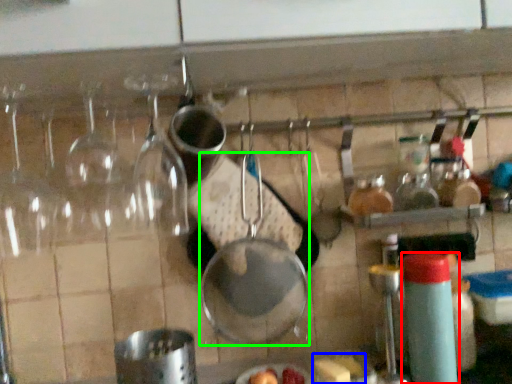
Question: Estimate the real-world distances between objects in this image. Which object is farther from bottle (highlighted by a red box), food (highlighted by a blue box) or frying pan (highlighted by a green box)?

Choices:
 (A) food
 (B) frying pan

Answer: (B)